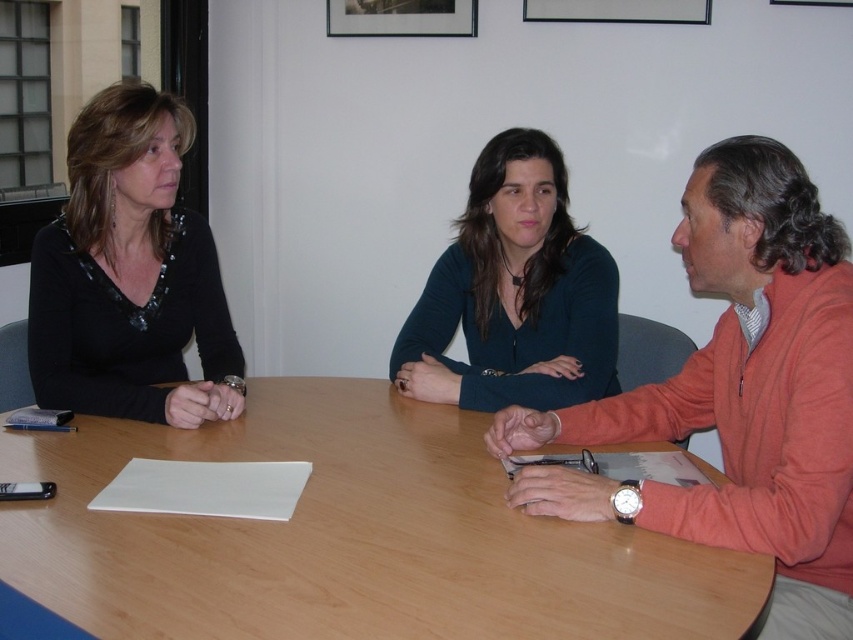
You are organizing a meeting and need to place a laptop on the table. The laptop requires a space that is to the right of the orange fleece jacket at right. Is there enough space available on the light brown wood table at center for this?

The light brown wood table at center is to the left of the orange fleece jacket at right, so placing the laptop to the right of the orange fleece jacket at right would not be possible on the table since the table is already positioned to the left of the jacket.

You are organizing a clothing display and need to arrange the orange fleece jacket at right and the black matte shirt at left based on their sizes. Which one should you place on the higher shelf to accommodate their sizes?

The orange fleece jacket at right should be placed on the higher shelf because it has a greater height compared to the black matte shirt at left.